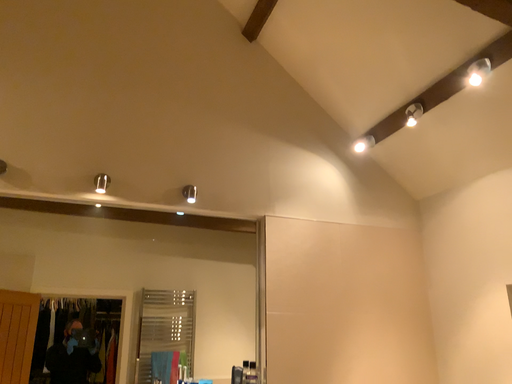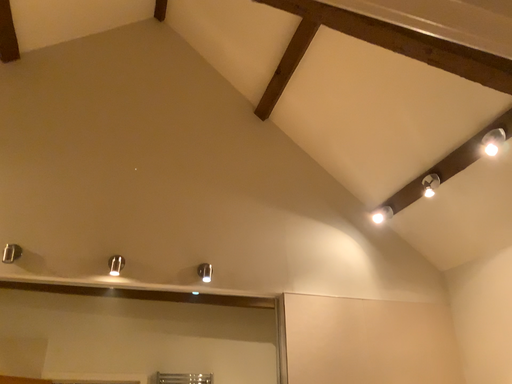
Question: How did the camera likely rotate when shooting the video?

Choices:
 (A) rotated upward
 (B) rotated downward

Answer: (A)